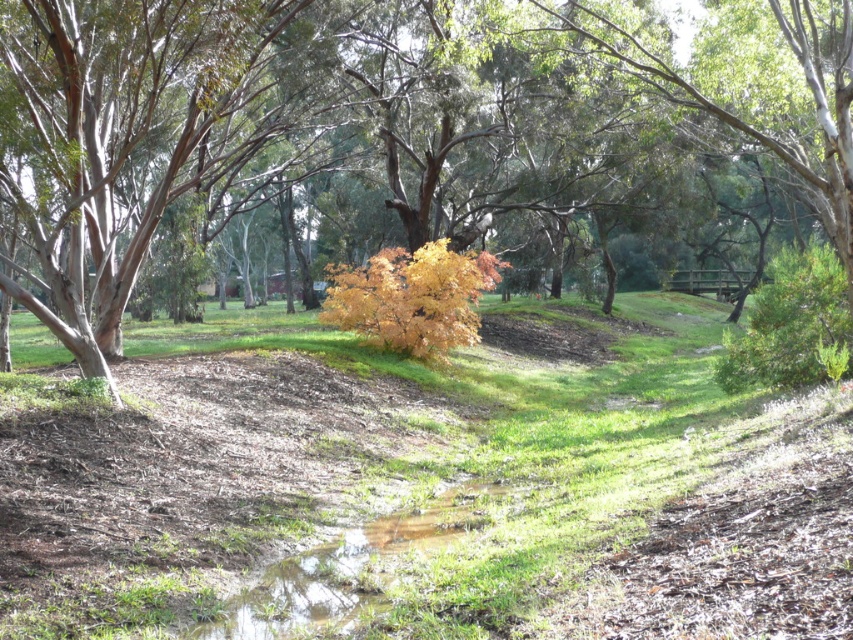
Is yellow leafy tree at center positioned in front of yellow autumn leaves at center?

Yes, it is.

What do you see at coordinates (434, 481) in the screenshot? I see `yellow leafy tree at center` at bounding box center [434, 481].

You are a GUI agent. You are given a task and a screenshot of the screen. Output one action in this format:
    pyautogui.click(x=<x>, y=<y>)
    Task: Click on the yellow leafy tree at center
    
    Given the screenshot: What is the action you would take?
    pyautogui.click(x=434, y=481)

Where is `yellow leafy tree at center`? This screenshot has height=640, width=853. yellow leafy tree at center is located at coordinates (434, 481).

Does yellow autumn leaves at center lie in front of green grassy puddle at lower center?

No, it is not.

Does point (805, 44) lie behind point (283, 570)?

Yes.

The height and width of the screenshot is (640, 853). I want to click on yellow autumn leaves at center, so click(x=386, y=120).

Identify the location of yellow leafy tree at center. (434, 481).

Does yellow leafy tree at center come in front of green grassy puddle at lower center?

Yes.

In the scene shown: Who is more forward, (x=508, y=636) or (x=326, y=593)?

Positioned in front is point (x=508, y=636).

The image size is (853, 640). I want to click on yellow leafy tree at center, so click(x=434, y=481).